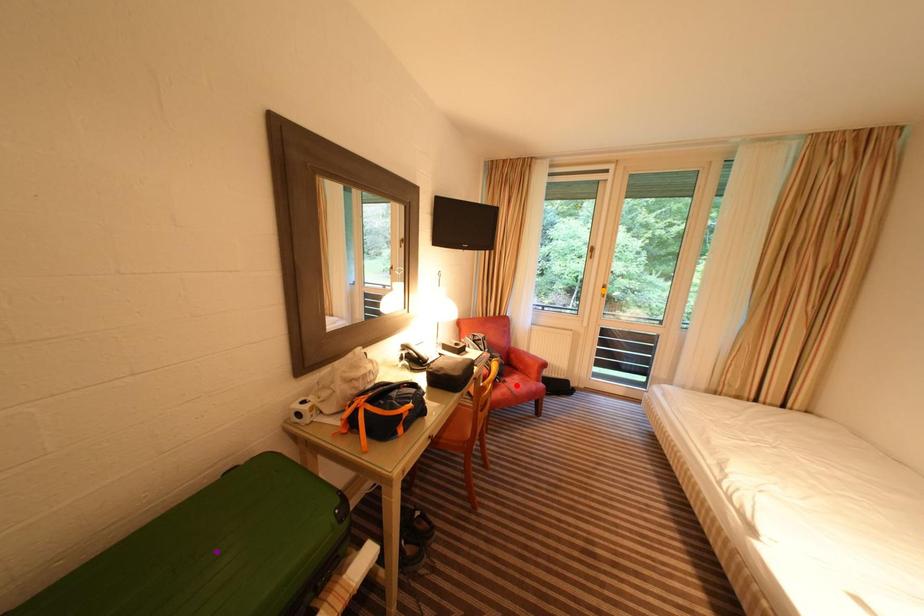
Order these from nearest to farthest:
orange point
purple point
red point

purple point
red point
orange point